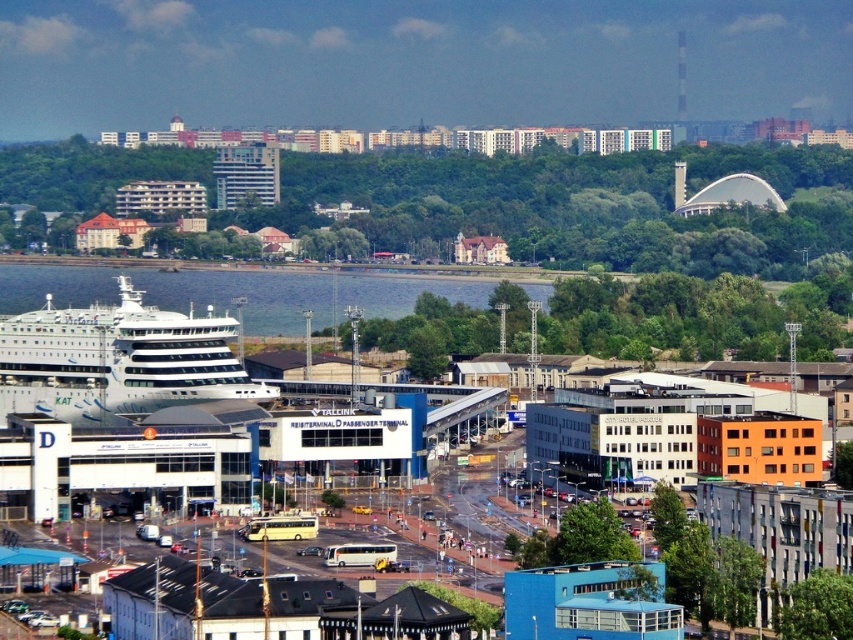
You are standing at the point labeled point [216,371] and want to reach the cruise ship docked at Tallink Reiseterminal D Passenger Terminal. If you can walk at a speed of 3 feet per second, how many seconds will it take you to reach the cruise ship?

The distance between point [216,371] and the cruise ship docked at Tallink Reiseterminal D Passenger Terminal is 2149.24 feet. At a walking speed of 3 feet per second, it would take approximately 716.41 seconds to reach the cruise ship.

Based on the scene description, where is the white glossy cruise ship at left located in the image?

The white glossy cruise ship at left is located at point [117,360] in the image.

You are a photographer planning to capture the white glossy cruise ship at left and the clear blue water at center in a single frame. Which object will appear narrower in your photo?

The white glossy cruise ship at left will appear narrower in the photo because it is thinner than the clear blue water at center.